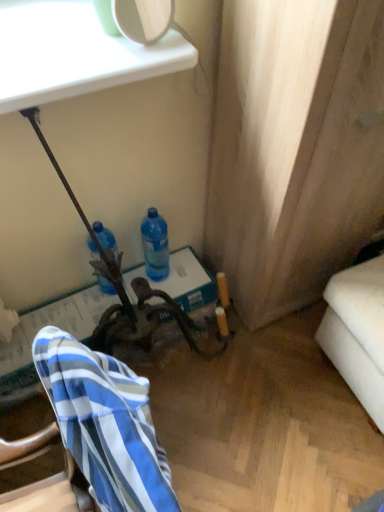
Question: Do you think blue translucent bottle at center, placed as the first bottle when sorted from right to left, is within blue striped fabric at lower left, or outside of it?

Choices:
 (A) outside
 (B) inside

Answer: (A)

Question: Considering the positions of point (158, 247) and point (114, 485), is point (158, 247) closer or farther from the camera than point (114, 485)?

Choices:
 (A) closer
 (B) farther

Answer: (B)

Question: Which is farther from the blue striped fabric at lower left?

Choices:
 (A) blue translucent bottle at center, placed as the first bottle when sorted from right to left
 (B) blue translucent bottle at center, which is the second bottle from right to left

Answer: (A)

Question: Which of these objects is positioned closest to the blue striped fabric at lower left?

Choices:
 (A) blue translucent bottle at center, placed as the first bottle when sorted from right to left
 (B) blue translucent bottle at center, which is the second bottle from right to left

Answer: (B)